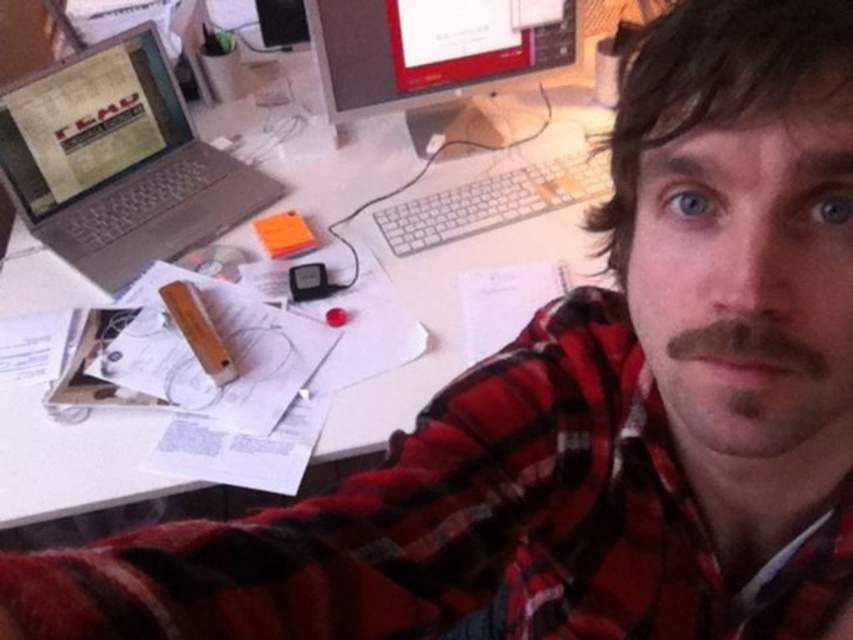
You are a delivery robot that needs to place a package on the desk without blocking the red plaid shirt at center or the matte black monitor at upper center. The package is 90 centimeters wide. Can you fit it between them?

The red plaid shirt at center is 94.46 centimeters from the matte black monitor at upper center. Since the package is 90 centimeters wide, which is slightly narrower than the distance between them, you can fit the package between the red plaid shirt at center and the matte black monitor at upper center without blocking either.

You are organizing the desk and need to place a new item between the white paper at upper center and the matte black monitor at upper center. Is there enough vertical space between them to fit a 2 cm thick notebook?

The white paper at upper center is below the matte black monitor at upper center, so there is vertical space between them. Since the notebook is only 2 cm thick, it should fit vertically between the white paper at upper center and the matte black monitor at upper center.